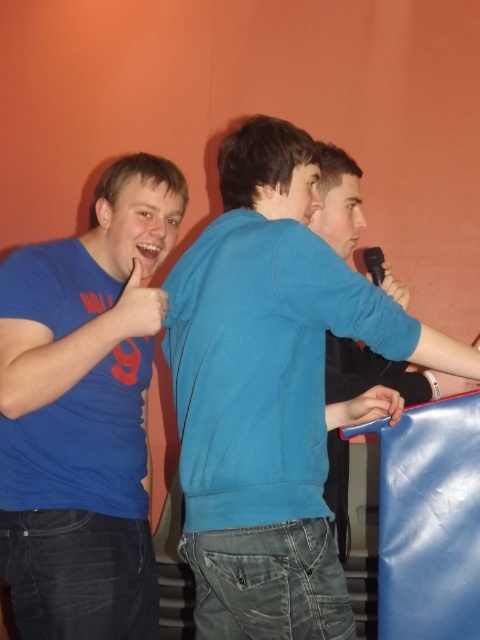
You are standing in the room and want to reach both the point at coordinates (63,492) and the point at coordinates (344,355). Which point should you go to first to minimize the total distance traveled?

You should go to point (63,492) first because it is closer to you than point (344,355), so visiting it first would minimize the total distance traveled.

You are standing in the room and want to place a small plant pot exactly at the point marked as point (73, 380). If you are 1.6 meters tall, can you comfortably reach that point to place the pot without needing a stool?

The distance of point (73, 380) from viewer is 1.34 meters. Since the point is within arm reach, you can comfortably place the plant pot there without needing a stool.